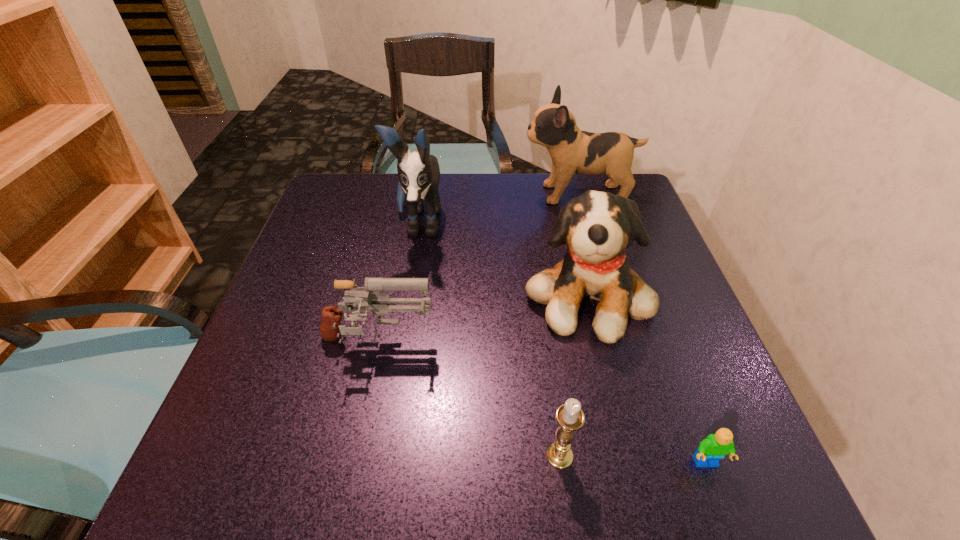
This screenshot has height=540, width=960. Identify the location of vacant space at the near left corner of the desktop. (264, 453).

You are a GUI agent. You are given a task and a screenshot of the screen. Output one action in this format:
    pyautogui.click(x=<x>, y=<y>)
    Task: Click on the unoccupied position between the leftmost puppy and the shortest puppy
    
    Given the screenshot: What is the action you would take?
    pyautogui.click(x=503, y=259)

You are a GUI agent. You are given a task and a screenshot of the screen. Output one action in this format:
    pyautogui.click(x=<x>, y=<y>)
    Task: Click on the free space between the Lego and the fourth shortest object
    
    Given the screenshot: What is the action you would take?
    pyautogui.click(x=647, y=379)

Where is `vacant area between the Lego and the shortest puppy`? vacant area between the Lego and the shortest puppy is located at coordinates (647, 379).

Locate an element on the screen. The image size is (960, 540). vacant point located between the leftmost puppy and the Lego is located at coordinates (563, 344).

Image resolution: width=960 pixels, height=540 pixels. I want to click on free space between the shortest puppy and the candle holder, so click(x=573, y=375).

This screenshot has width=960, height=540. I want to click on the fifth closest object to the leftmost puppy, so click(713, 448).

Locate which object is the fourth closest to the leftmost puppy. Please provide its 2D coordinates. Your answer should be formatted as a tuple, i.e. [(x, y)], where the tuple contains the x and y coordinates of a point satisfying the conditions above.

[(569, 416)]

Where is `puppy that is the closest one to the third tallest object`? The image size is (960, 540). puppy that is the closest one to the third tallest object is located at coordinates (572, 151).

This screenshot has width=960, height=540. Identify the location of puppy that is the closest to the shortest puppy. (572, 151).